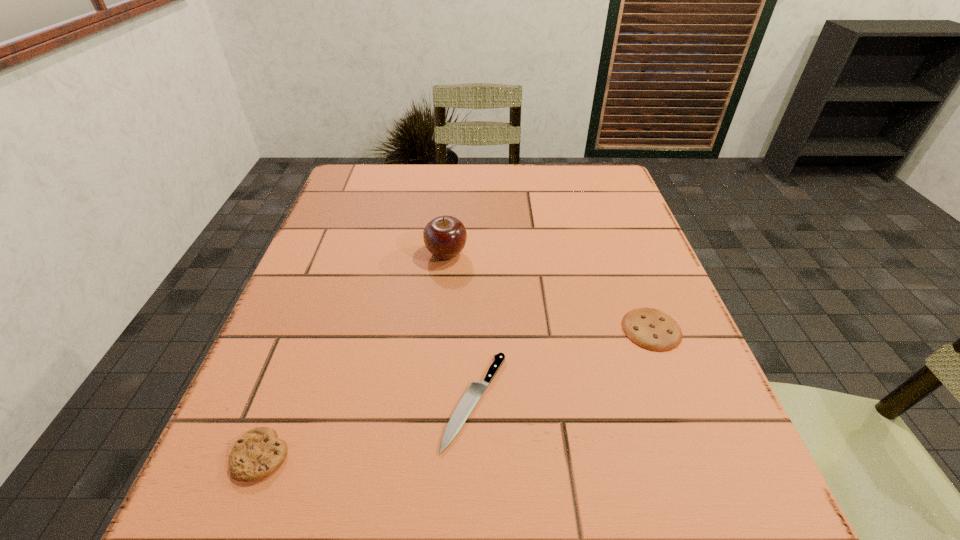
The image size is (960, 540). I want to click on free space at the far right corner of the desktop, so click(603, 173).

At what (x,y) coordinates should I click in order to perform the action: click on free space between the second tallest object and the shortest object. Please return your answer as a coordinate pair (x, y). This screenshot has height=540, width=960. Looking at the image, I should click on (369, 428).

Locate an element on the screen. This screenshot has width=960, height=540. vacant space in between the taller cookie and the shorter cookie is located at coordinates (456, 393).

Where is `free area in between the farther cookie and the taller cookie`? The image size is (960, 540). free area in between the farther cookie and the taller cookie is located at coordinates (456, 393).

Image resolution: width=960 pixels, height=540 pixels. What are the coordinates of `vacant region between the taller cookie and the shortest object` in the screenshot? It's located at (369, 428).

I want to click on vacant region between the farther cookie and the taller cookie, so click(x=456, y=393).

Identify the location of free spot between the shortest object and the left cookie. (369, 428).

This screenshot has width=960, height=540. What are the coordinates of `free space between the third nearest object and the third shortest object` in the screenshot? It's located at (456, 393).

Identify the location of blank region between the left cookie and the steak knife. The width and height of the screenshot is (960, 540). 369,428.

You are a GUI agent. You are given a task and a screenshot of the screen. Output one action in this format:
    pyautogui.click(x=<x>, y=<y>)
    Task: Click on the empty space that is in between the nearer cookie and the apple
    
    Given the screenshot: What is the action you would take?
    pyautogui.click(x=353, y=355)